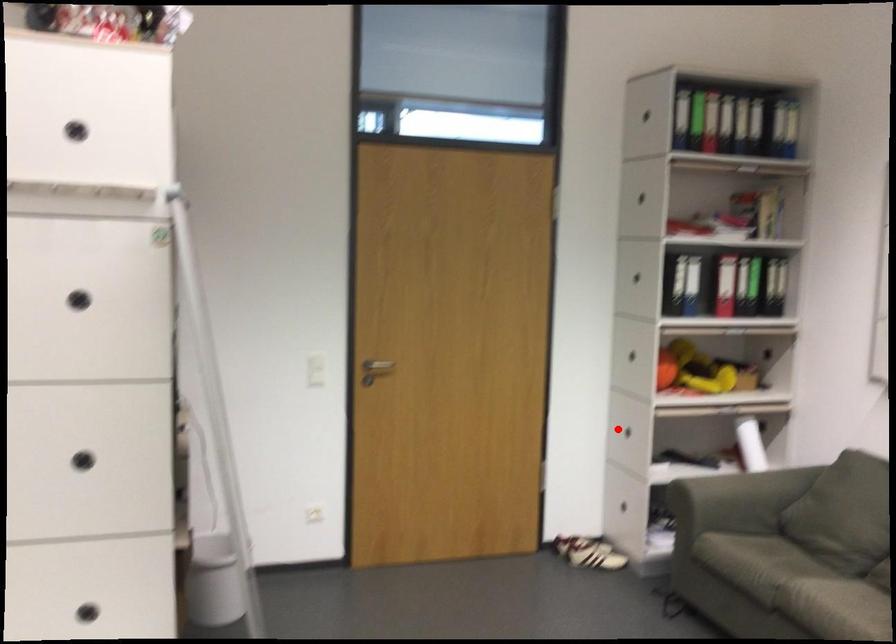
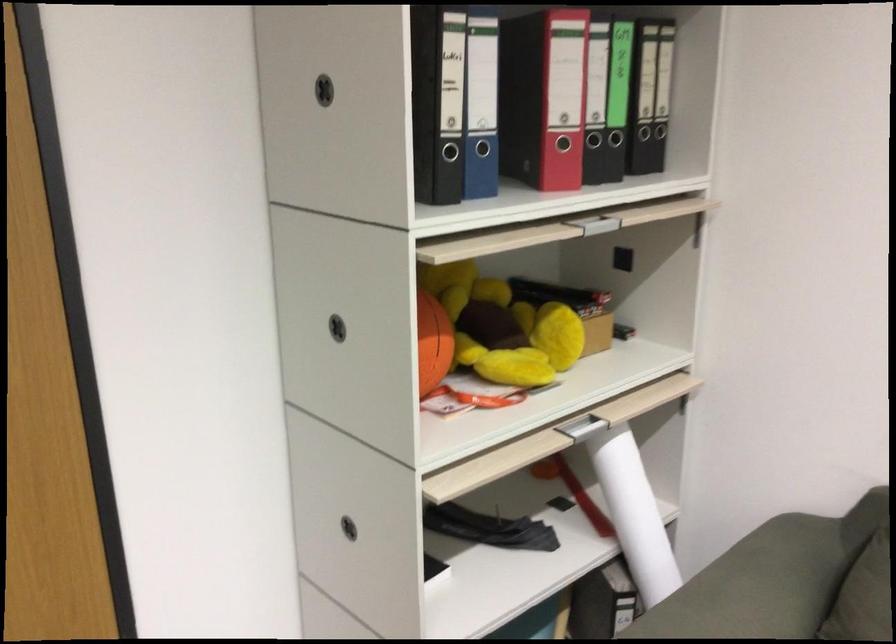
Question: I am providing you with two images of the same scene from different viewpoints. A red point is marked on the first image. Is the red point's position out of view in image 2?

Choices:
 (A) Yes
 (B) No

Answer: (B)